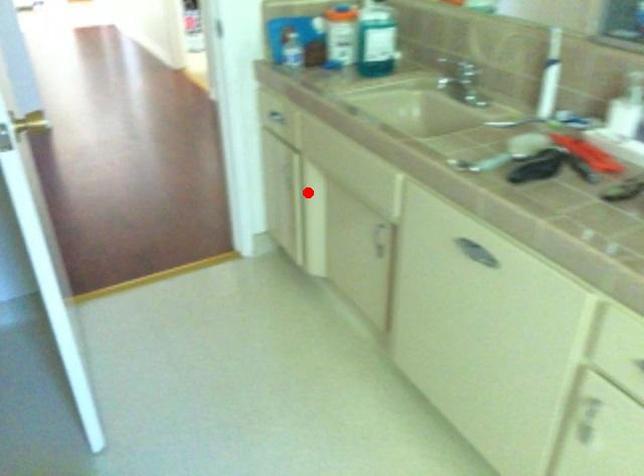
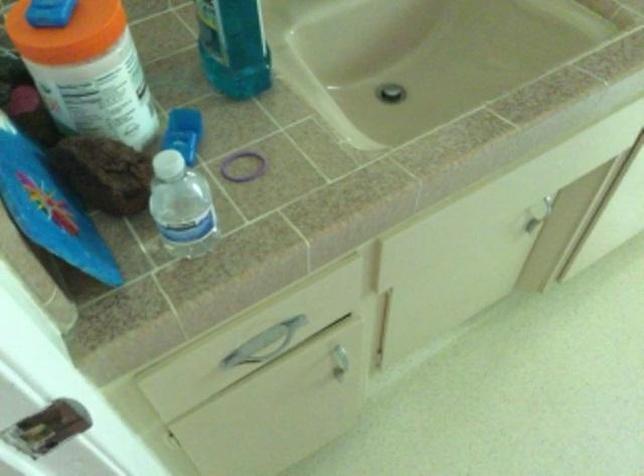
Where in the second image is the point corresponding to the highlighted location from the first image?

(339, 357)